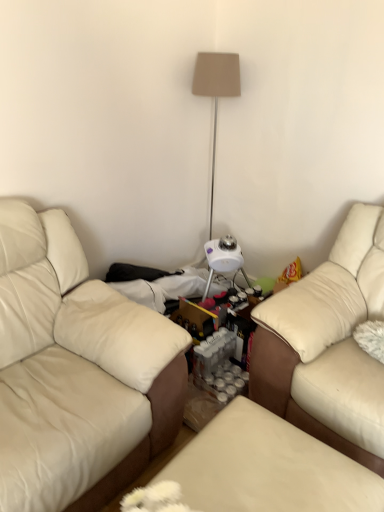
The height and width of the screenshot is (512, 384). In order to click on vacant space situated above leather ottoman at center (from a real-world perspective) in this screenshot , I will do `click(264, 465)`.